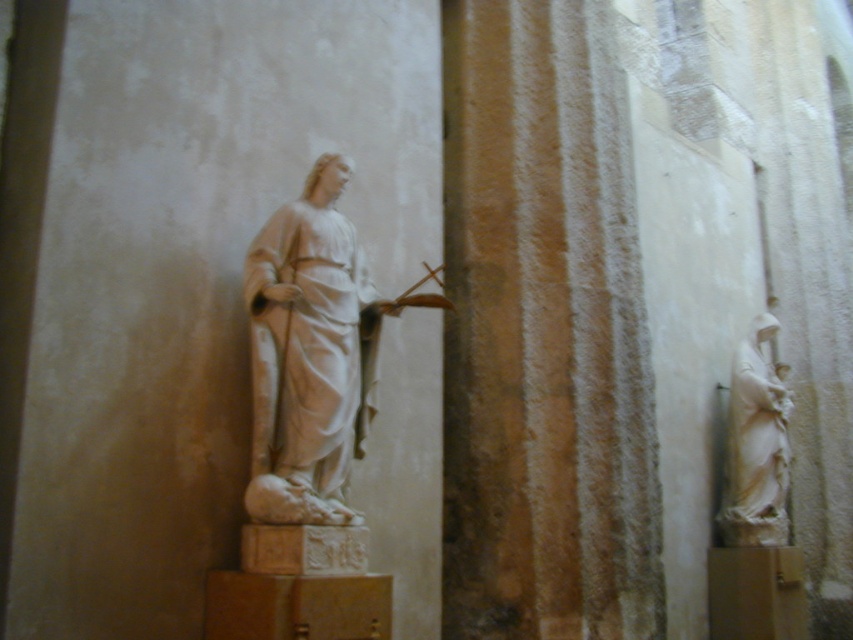
Question: Is the position of white marble statue at center more distant than that of white marble statue at right?

Choices:
 (A) yes
 (B) no

Answer: (B)

Question: Which of the following is the closest to the observer?

Choices:
 (A) white marble statue at center
 (B) white marble statue at right

Answer: (A)

Question: Where is white marble statue at center located in relation to white marble statue at right in the image?

Choices:
 (A) above
 (B) below

Answer: (A)

Question: Which of the following is the farthest from the observer?

Choices:
 (A) white marble statue at center
 (B) white marble statue at right

Answer: (B)

Question: Is white marble statue at center closer to camera compared to white marble statue at right?

Choices:
 (A) no
 (B) yes

Answer: (B)